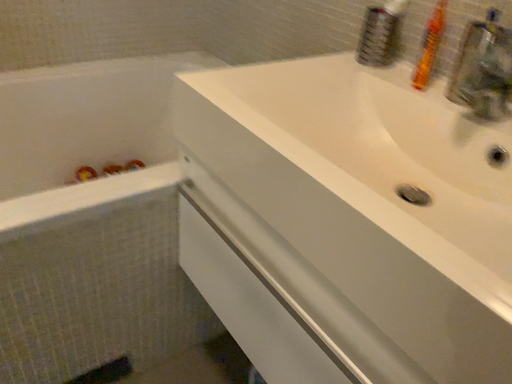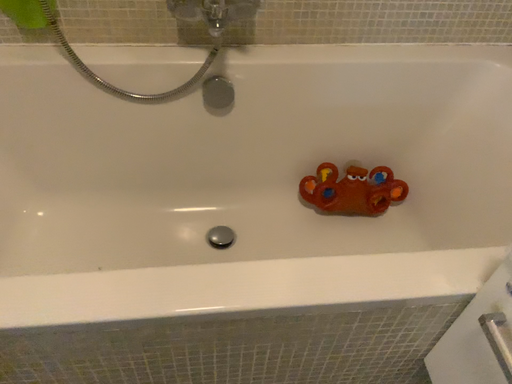
Question: Which way did the camera rotate in the video?

Choices:
 (A) rotated right
 (B) rotated left

Answer: (B)